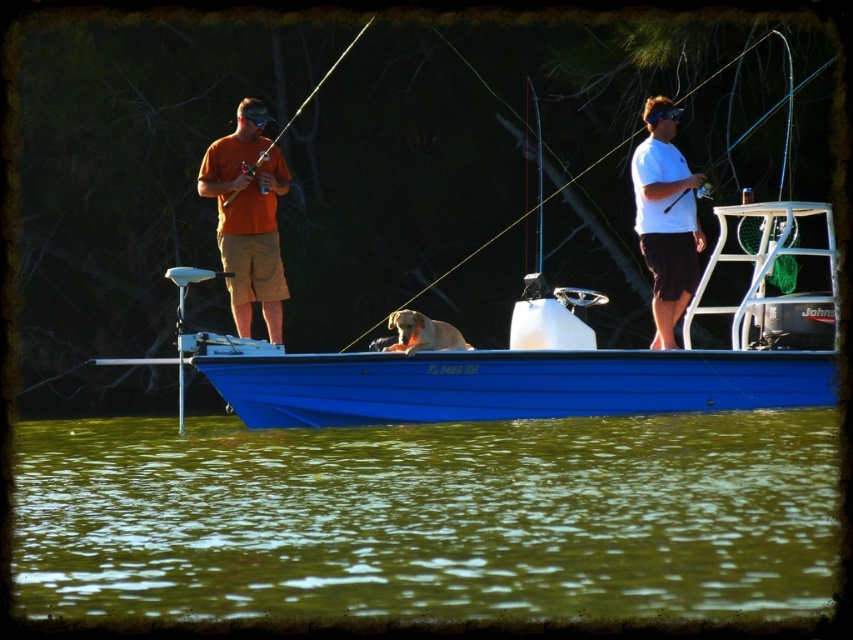
Consider the image. You are a photographer taking a picture of the fishing scene. The orange cotton shirt at center and the white matte shirt at right are both in the frame. Which shirt will appear bigger in the photo?

The orange cotton shirt at center will appear bigger in the photo because it is larger in size than the white matte shirt at right.

You are a passenger on the bright blue motorboat with white trim. You notice the green algae water at lower center and the orange cotton shirt at center. Which object is closer to you as you stand on the deck facing forward?

The green algae water at lower center is closer to you because it is in front of the orange cotton shirt at center.